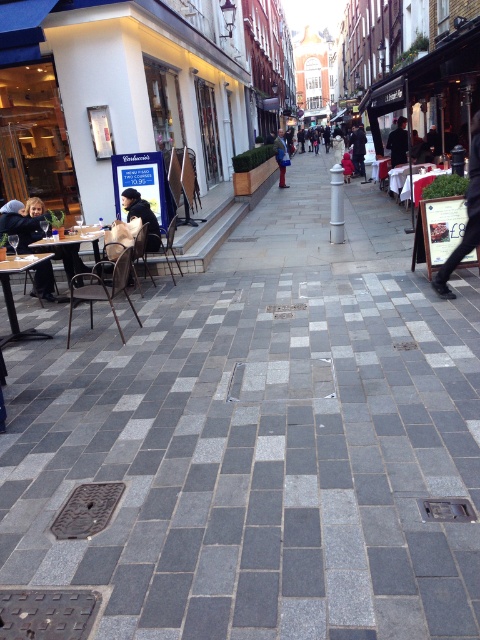
Can you confirm if metallic brown chair at left is thinner than white glossy table at center?

No, metallic brown chair at left is not thinner than white glossy table at center.

Is metallic brown chair at left shorter than white glossy table at center?

Yes, metallic brown chair at left is shorter than white glossy table at center.

Who is more forward, (70, 304) or (398, 170)?

Point (70, 304) is more forward.

Locate an element on the screen. Image resolution: width=480 pixels, height=640 pixels. metallic brown chair at left is located at coordinates (101, 288).

This screenshot has width=480, height=640. Find the location of `metallic silver chair at left`. metallic silver chair at left is located at coordinates (166, 244).

Is metallic silver chair at left bigger than white glossy table at center?

Incorrect, metallic silver chair at left is not larger than white glossy table at center.

Which is in front, point (167, 248) or point (399, 188)?

Point (167, 248) is in front.

Where is `metallic silver chair at left`? Image resolution: width=480 pixels, height=640 pixels. metallic silver chair at left is located at coordinates (166, 244).

Describe the element at coordinates (71, 250) in the screenshot. I see `wooden table at left` at that location.

Between wooden table at left and dark brown leather jacket at center, which one appears on the left side from the viewer's perspective?

wooden table at left is more to the left.

Identify the location of wooden table at left. (71, 250).